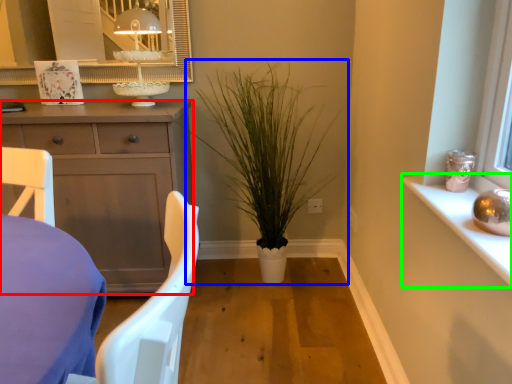
Question: Which object is the closest to the cabinetry (highlighted by a red box)? Choose among these: houseplant (highlighted by a blue box) or window sill (highlighted by a green box).

Choices:
 (A) houseplant
 (B) window sill

Answer: (A)